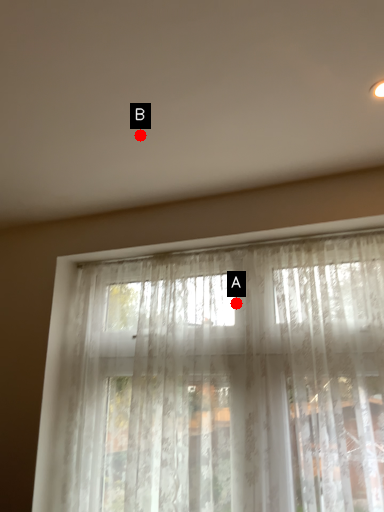
Question: Two points are circled on the image, labeled by A and B beside each circle. Which point is closer to the camera?

Choices:
 (A) A is closer
 (B) B is closer

Answer: (B)